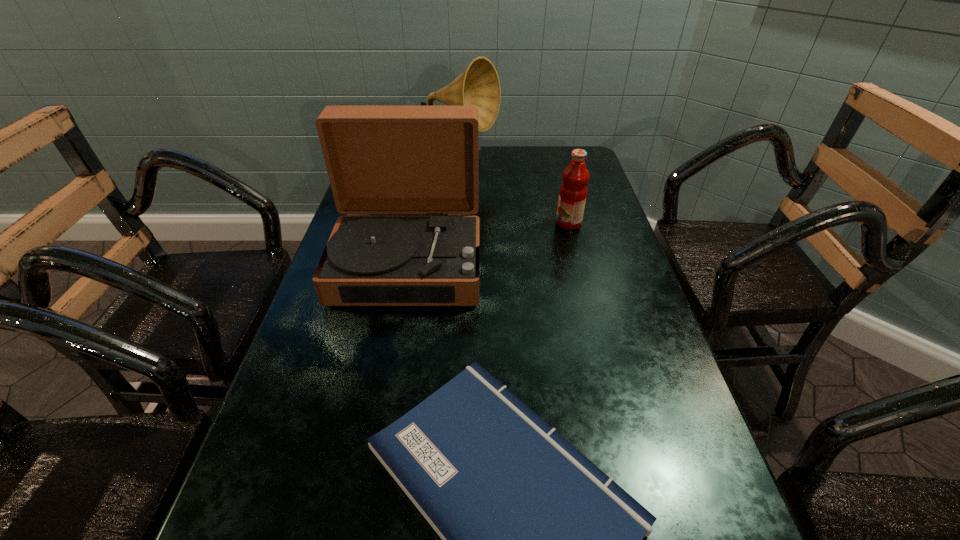
The width and height of the screenshot is (960, 540). I want to click on the farthest object, so click(x=479, y=85).

Locate an element on the screen. This screenshot has height=540, width=960. the nearer phonograph record is located at coordinates click(x=380, y=159).

You are a GUI agent. You are given a task and a screenshot of the screen. Output one action in this format:
    pyautogui.click(x=<x>, y=<y>)
    Task: Click on the third tallest object
    
    Given the screenshot: What is the action you would take?
    pyautogui.click(x=573, y=191)

Find the location of a particular element. vacant space located on the horn of the farther phonograph record is located at coordinates (563, 165).

The image size is (960, 540). Identify the location of vacant space situated on the face of the nearer phonograph record. (392, 350).

In order to click on vacant space located 0.330m on the front label of the fruit juice in this screenshot , I will do `click(436, 223)`.

The height and width of the screenshot is (540, 960). What are the coordinates of `vacant space located 0.090m on the front label of the fruit juice` in the screenshot? It's located at (523, 223).

Find the location of `vacant space located 0.350m on the front label of the fruit juice`. vacant space located 0.350m on the front label of the fruit juice is located at coordinates (428, 223).

Where is `object that is at the far edge`? The image size is (960, 540). object that is at the far edge is located at coordinates (479, 85).

Find the location of a particular element. object positioned at the left edge is located at coordinates click(x=380, y=159).